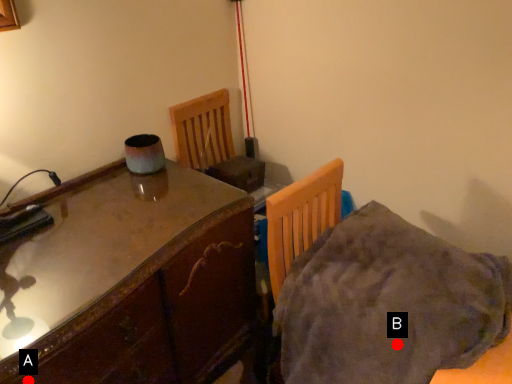
Question: Two points are circled on the image, labeled by A and B beside each circle. Among these points, which one is farthest from the camera?

Choices:
 (A) A is further
 (B) B is further

Answer: (B)